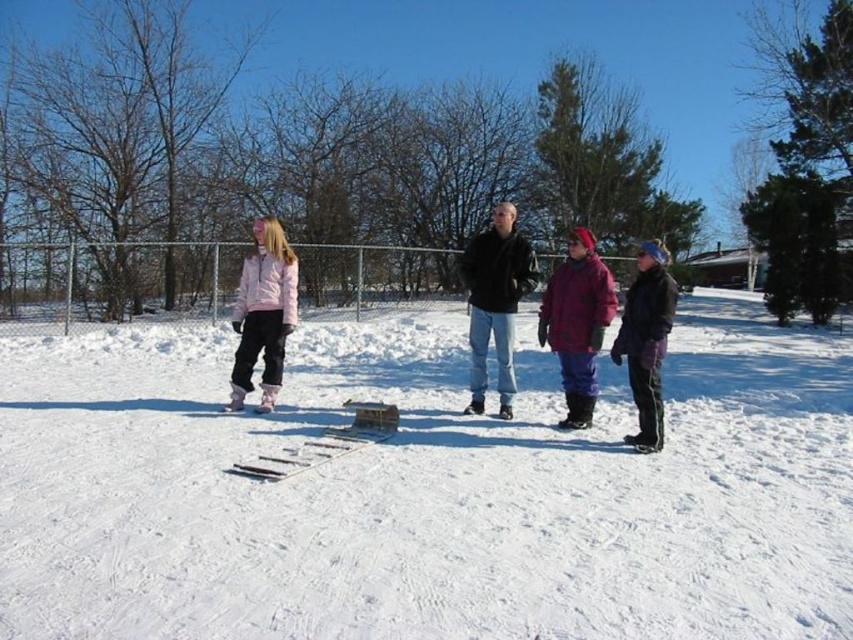
Question: Does white matte snow at center appear over black matte jacket at center?

Choices:
 (A) no
 (B) yes

Answer: (A)

Question: Which object is farther from the camera taking this photo?

Choices:
 (A) purple fleece jacket at center
 (B) purple fleece jacket at right
 (C) pink fleece jacket at left

Answer: (C)

Question: Is pink fleece jacket at left further to camera compared to purple fleece jacket at right?

Choices:
 (A) no
 (B) yes

Answer: (B)

Question: Considering the relative positions of black matte jacket at center and purple fleece jacket at center in the image provided, where is black matte jacket at center located with respect to purple fleece jacket at center?

Choices:
 (A) left
 (B) right

Answer: (A)

Question: Which of the following is the farthest from the observer?

Choices:
 (A) (270, 353)
 (B) (219, 452)

Answer: (A)

Question: Which point is closer to the camera?

Choices:
 (A) pink fleece jacket at left
 (B) purple fleece jacket at right
 (C) white matte snow at center

Answer: (C)